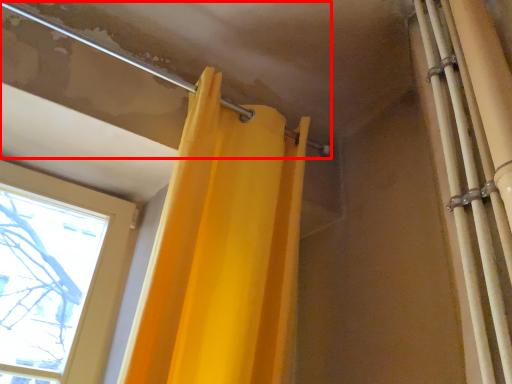
Question: From the image's perspective, what is the correct spatial relationship of pipe (annotated by the red box) in relation to shower curtain?

Choices:
 (A) above
 (B) below

Answer: (A)